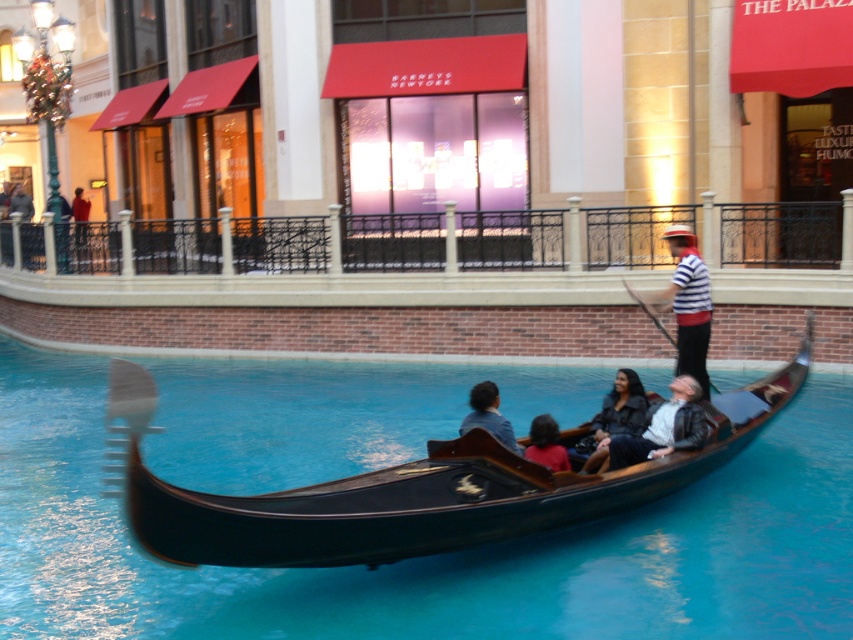
Between leather jacket at center and matte red shirt at center, which one has more height?

With more height is leather jacket at center.

Does point (648, 436) come behind point (556, 438)?

Yes, it is behind point (556, 438).

Image resolution: width=853 pixels, height=640 pixels. Identify the location of leather jacket at center. (659, 429).

Between leather jacket at center and red shirt at upper left, which one appears on the right side from the viewer's perspective?

From the viewer's perspective, leather jacket at center appears more on the right side.

Between point (659, 452) and point (79, 189), which one is positioned behind?

Positioned behind is point (79, 189).

Locate an element on the screen. The width and height of the screenshot is (853, 640). leather jacket at center is located at coordinates (659, 429).

Can you confirm if leather jacket at center is thinner than striped cotton shirt at center?

No.

Who is positioned more to the right, leather jacket at center or striped cotton shirt at center?

From the viewer's perspective, striped cotton shirt at center appears more on the right side.

Locate an element on the screen. Image resolution: width=853 pixels, height=640 pixels. leather jacket at center is located at coordinates (659, 429).